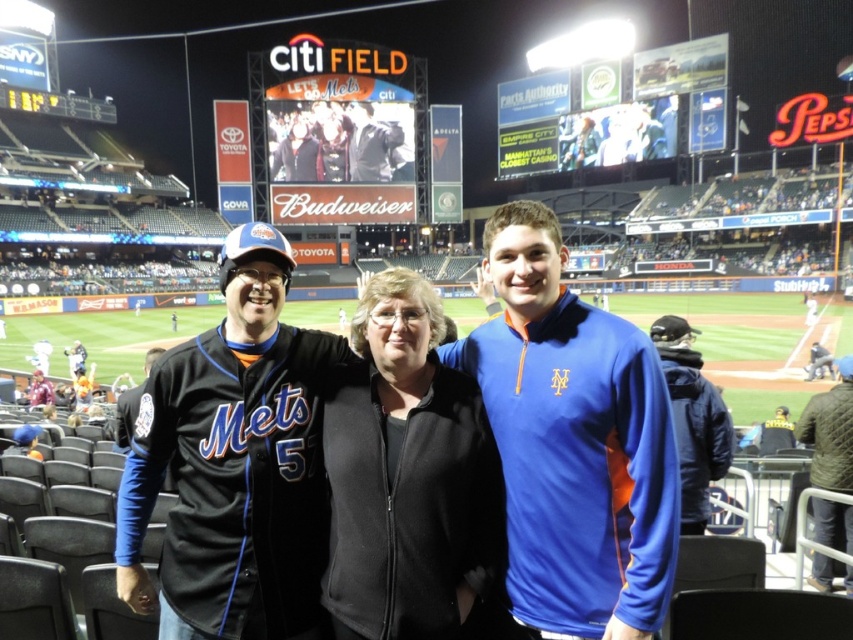
Is black zip-up jacket at center shorter than knitted wool sweater at lower right?

No, black zip-up jacket at center is not shorter than knitted wool sweater at lower right.

Can you confirm if black zip-up jacket at center is positioned below knitted wool sweater at lower right?

Incorrect, black zip-up jacket at center is not positioned below knitted wool sweater at lower right.

Is point (326, 604) closer to camera compared to point (850, 358)?

Yes.

You are a GUI agent. You are given a task and a screenshot of the screen. Output one action in this format:
    pyautogui.click(x=<x>, y=<y>)
    Task: Click on the black zip-up jacket at center
    
    Given the screenshot: What is the action you would take?
    click(x=407, y=476)

Measure the distance between yellow fabric cap at right and dark blue jersey at left.

The distance of yellow fabric cap at right from dark blue jersey at left is 36.17 meters.

Does yellow fabric cap at right have a smaller size compared to dark blue jersey at left?

Indeed, yellow fabric cap at right has a smaller size compared to dark blue jersey at left.

Describe the element at coordinates (770, 433) in the screenshot. I see `yellow fabric cap at right` at that location.

Where is `yellow fabric cap at right`? The height and width of the screenshot is (640, 853). yellow fabric cap at right is located at coordinates (770, 433).

Does point (265, 252) come in front of point (782, 419)?

Yes.

Between black jersey at center and yellow fabric cap at right, which one is positioned lower?

yellow fabric cap at right is lower down.

Image resolution: width=853 pixels, height=640 pixels. What are the coordinates of `black jersey at center` in the screenshot? It's located at (234, 461).